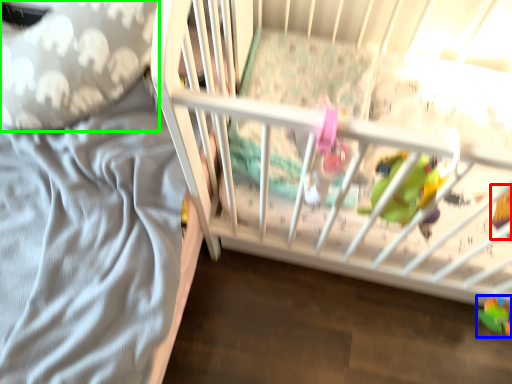
Question: Considering the real-world distances, which object is closest to toy (highlighted by a red box)? toy (highlighted by a blue box) or throw pillow (highlighted by a green box).

Choices:
 (A) toy
 (B) throw pillow

Answer: (A)